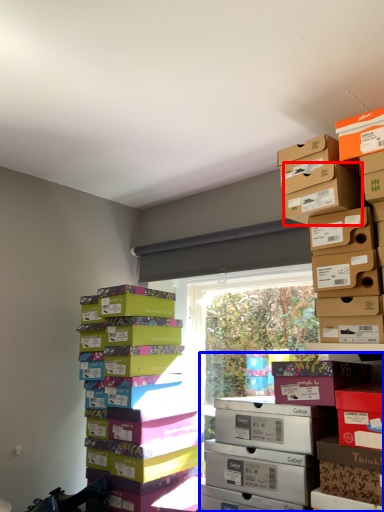
Question: Among these objects, which one is nearest to the camera, cardboard box (highlighted by a red box) or shelf (highlighted by a blue box)?

Choices:
 (A) cardboard box
 (B) shelf

Answer: (B)